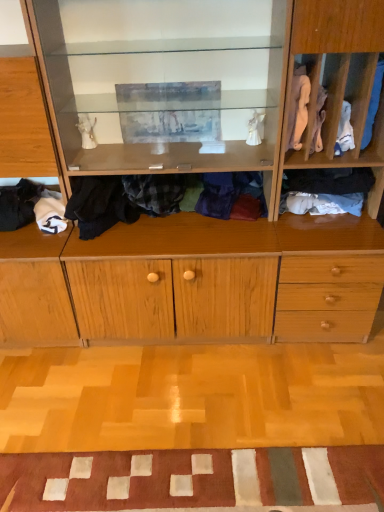
Image resolution: width=384 pixels, height=512 pixels. Describe the element at coordinates (35, 290) in the screenshot. I see `light wood cabinet at left, the second cabinetry in the right-to-left sequence` at that location.

In the scene shown: Measure the distance between point (131, 67) and camera.

Point (131, 67) and camera are 1.87 meters apart.

Measure the distance between wooden cabinet at center, which is the 1th cabinetry in right-to-left order, and camera.

wooden cabinet at center, which is the 1th cabinetry in right-to-left order, and camera are 4.68 feet apart from each other.

The image size is (384, 512). In order to click on soft white fabric at lower left, the sixth clothing positioned from the right in this screenshot , I will do `click(18, 204)`.

What do you see at coordinates (18, 204) in the screenshot? The height and width of the screenshot is (512, 384). I see `soft white fabric at lower left, which appears as the 1th clothing when viewed from the left` at bounding box center [18, 204].

The height and width of the screenshot is (512, 384). Identify the location of white fabric at right, the fourth clothing when ordered from right to left. (298, 106).

Identify the location of the 1st clothing behind the dark blue fabric at right, which appears as the third clothing when viewed from the right, counting from the anchor's position. click(x=18, y=204).

Considering the relative sizes of dark blue fabric at right, the fourth clothing in the left-to-right sequence, and soft white fabric at lower left, the sixth clothing positioned from the right, in the image provided, is dark blue fabric at right, the fourth clothing in the left-to-right sequence, smaller than soft white fabric at lower left, the sixth clothing positioned from the right,?

Correct, dark blue fabric at right, the fourth clothing in the left-to-right sequence, occupies less space than soft white fabric at lower left, the sixth clothing positioned from the right.

Is dark blue fabric at right, the fourth clothing in the left-to-right sequence, with soft white fabric at lower left, the sixth clothing positioned from the right?

Answer: No, dark blue fabric at right, the fourth clothing in the left-to-right sequence, is not beside soft white fabric at lower left, the sixth clothing positioned from the right.

From the image's perspective, is light wood cabinet at left, the second cabinetry in the right-to-left sequence, located above blue cotton socks at right, arranged as the 1th clothing when viewed from the right?

No, from the image's perspective, light wood cabinet at left, the second cabinetry in the right-to-left sequence, is not on top of blue cotton socks at right, arranged as the 1th clothing when viewed from the right.

Is light wood cabinet at left, marked as the first cabinetry in a left-to-right arrangement, far away from blue cotton socks at right, arranged as the 1th clothing when viewed from the right?

Yes.

Considering the sizes of objects light wood cabinet at left, marked as the first cabinetry in a left-to-right arrangement, and blue cotton socks at right, arranged as the 1th clothing when viewed from the right, in the image provided, who is bigger, light wood cabinet at left, marked as the first cabinetry in a left-to-right arrangement, or blue cotton socks at right, arranged as the 1th clothing when viewed from the right,?

light wood cabinet at left, marked as the first cabinetry in a left-to-right arrangement.

Which point is more forward, (56, 244) or (383, 59)?

The point (383, 59) is more forward.

From a real-world perspective, is wooden cabinet at center, which is the second cabinetry in left-to-right order, positioned over soft white fabric at lower left, which appears as the 1th clothing when viewed from the left, based on gravity?

Yes, from a real-world perspective, wooden cabinet at center, which is the second cabinetry in left-to-right order, is above soft white fabric at lower left, which appears as the 1th clothing when viewed from the left.

In terms of height, does wooden cabinet at center, which is the second cabinetry in left-to-right order, look taller or shorter compared to soft white fabric at lower left, the sixth clothing positioned from the right?

Considering their sizes, wooden cabinet at center, which is the second cabinetry in left-to-right order, has more height than soft white fabric at lower left, the sixth clothing positioned from the right.

Which object is further away from the camera, wooden cabinet at center, which is the second cabinetry in left-to-right order, or soft white fabric at lower left, the sixth clothing positioned from the right?

Positioned behind is soft white fabric at lower left, the sixth clothing positioned from the right.

From the image's perspective, which one is positioned higher, flannel shirt at center, which appears as the 5th clothing when viewed from the right, or white cotton socks at right, which appears as the 2th clothing when viewed from the right?

flannel shirt at center, which appears as the 5th clothing when viewed from the right, is shown above in the image.

Considering the relative sizes of flannel shirt at center, which appears as the 5th clothing when viewed from the right, and white cotton socks at right, which is the fifth clothing in left-to-right order, in the image provided, is flannel shirt at center, which appears as the 5th clothing when viewed from the right, taller than white cotton socks at right, which is the fifth clothing in left-to-right order,?

Yes, flannel shirt at center, which appears as the 5th clothing when viewed from the right, is taller than white cotton socks at right, which is the fifth clothing in left-to-right order.

Is flannel shirt at center, which appears as the 5th clothing when viewed from the right, looking in the opposite direction of white cotton socks at right, which appears as the 2th clothing when viewed from the right?

No, flannel shirt at center, which appears as the 5th clothing when viewed from the right,'s orientation is not away from white cotton socks at right, which appears as the 2th clothing when viewed from the right.

The image size is (384, 512). There is a white cotton socks at right, which is the fifth clothing in left-to-right order. In order to click on the 2nd clothing above it (from a real-world perspective) in this screenshot , I will do `click(122, 200)`.

Is soft white fabric at lower left, which appears as the 1th clothing when viewed from the left, at the right side of white cotton socks at right, which appears as the 2th clothing when viewed from the right?

Incorrect, soft white fabric at lower left, which appears as the 1th clothing when viewed from the left, is not on the right side of white cotton socks at right, which appears as the 2th clothing when viewed from the right.

Based on the photo, is soft white fabric at lower left, the sixth clothing positioned from the right, smaller than white cotton socks at right, which is the fifth clothing in left-to-right order?

No.

Find the location of a particular element. The image size is (384, 512). clothing behind the soft white fabric at lower left, which appears as the 1th clothing when viewed from the left is located at coordinates (321, 203).

Considering the positions of points (11, 188) and (349, 212), is point (11, 188) farther from camera compared to point (349, 212)?

Yes, it is behind point (349, 212).

From the image's perspective, who appears lower, blue cotton socks at right, the 6th clothing viewed from the left, or wooden cabinet at center, which is the second cabinetry in left-to-right order?

wooden cabinet at center, which is the second cabinetry in left-to-right order, from the image's perspective.

Is point (376, 101) farther from camera compared to point (227, 240)?

No, (376, 101) is closer to viewer.

Considering the relative positions of blue cotton socks at right, arranged as the 1th clothing when viewed from the right, and wooden cabinet at center, which is the second cabinetry in left-to-right order, in the image provided, is blue cotton socks at right, arranged as the 1th clothing when viewed from the right, to the left or to the right of wooden cabinet at center, which is the second cabinetry in left-to-right order,?

blue cotton socks at right, arranged as the 1th clothing when viewed from the right, is to the right of wooden cabinet at center, which is the second cabinetry in left-to-right order.

Between blue cotton socks at right, the 6th clothing viewed from the left, and wooden cabinet at center, which is the second cabinetry in left-to-right order, which one is positioned behind?

blue cotton socks at right, the 6th clothing viewed from the left, is further away from the camera.

Who is shorter, blue cotton socks at right, arranged as the 1th clothing when viewed from the right, or white cotton socks at right, which appears as the 2th clothing when viewed from the right?

Standing shorter between the two is white cotton socks at right, which appears as the 2th clothing when viewed from the right.

Between blue cotton socks at right, arranged as the 1th clothing when viewed from the right, and white cotton socks at right, which is the fifth clothing in left-to-right order, which one has larger size?

With larger size is white cotton socks at right, which is the fifth clothing in left-to-right order.

Could white cotton socks at right, which is the fifth clothing in left-to-right order, be considered to be inside blue cotton socks at right, the 6th clothing viewed from the left?

Definitely not — white cotton socks at right, which is the fifth clothing in left-to-right order, is not inside blue cotton socks at right, the 6th clothing viewed from the left.

Considering the points (362, 145) and (360, 203), which point is in front, point (362, 145) or point (360, 203)?

The point (362, 145) is in front.

From the soft white fabric at lower left, which appears as the 1th clothing when viewed from the left, count 3rd clothing to the right and point to it. Please provide its 2D coordinates.

[(327, 187)]

This screenshot has height=512, width=384. I want to click on the 1st cabinetry in front of the blue cotton socks at right, the 6th clothing viewed from the left, counting from the anchor's position, so click(35, 290).

Considering their positions, is white fabric at right, the third clothing in the left-to-right sequence, positioned further to flannel shirt at center, the second clothing when ordered from left to right, than patchwork fabric doormat at lower center?

patchwork fabric doormat at lower center is further to flannel shirt at center, the second clothing when ordered from left to right.

In the scene shown: Which object lies nearer to the anchor point flannel shirt at center, which appears as the 5th clothing when viewed from the right, soft white fabric at lower left, which appears as the 1th clothing when viewed from the left, or white cotton socks at right, which appears as the 2th clothing when viewed from the right?

soft white fabric at lower left, which appears as the 1th clothing when viewed from the left, is positioned closer to the anchor flannel shirt at center, which appears as the 5th clothing when viewed from the right.

Considering their positions, is white cotton socks at right, which is the fifth clothing in left-to-right order, positioned further to blue cotton socks at right, arranged as the 1th clothing when viewed from the right, than wooden cabinet at center, which is the 1th cabinetry in right-to-left order?

Based on the image, wooden cabinet at center, which is the 1th cabinetry in right-to-left order, appears to be further to blue cotton socks at right, arranged as the 1th clothing when viewed from the right.

Estimate the real-world distances between objects in this image. Which object is closer to wooden cabinet at center, which is the 1th cabinetry in right-to-left order, white cotton socks at right, which appears as the 2th clothing when viewed from the right, or flannel shirt at center, the second clothing when ordered from left to right?

Based on the image, flannel shirt at center, the second clothing when ordered from left to right, appears to be nearer to wooden cabinet at center, which is the 1th cabinetry in right-to-left order.

Estimate the real-world distances between objects in this image. Which object is closer to white fabric at right, the third clothing in the left-to-right sequence, wooden cabinet at center, which is the 1th cabinetry in right-to-left order, or dark blue fabric at right, which appears as the third clothing when viewed from the right?

dark blue fabric at right, which appears as the third clothing when viewed from the right.

From the picture: When comparing their distances from blue cotton socks at right, arranged as the 1th clothing when viewed from the right, does dark blue fabric at right, which appears as the third clothing when viewed from the right, or light wood cabinet at left, the second cabinetry in the right-to-left sequence, seem further?

light wood cabinet at left, the second cabinetry in the right-to-left sequence.

Considering their positions, is wooden cabinet at center, which is the second cabinetry in left-to-right order, positioned further to flannel shirt at center, which appears as the 5th clothing when viewed from the right, than light wood cabinet at left, marked as the first cabinetry in a left-to-right arrangement?

The object further to flannel shirt at center, which appears as the 5th clothing when viewed from the right, is light wood cabinet at left, marked as the first cabinetry in a left-to-right arrangement.

Estimate the real-world distances between objects in this image. Which object is further from wooden cabinet at center, which is the second cabinetry in left-to-right order, white fabric at right, the third clothing in the left-to-right sequence, or light wood cabinet at left, the second cabinetry in the right-to-left sequence?

The object further to wooden cabinet at center, which is the second cabinetry in left-to-right order, is white fabric at right, the third clothing in the left-to-right sequence.

I want to click on doormat between soft white fabric at lower left, which appears as the 1th clothing when viewed from the left, and blue cotton socks at right, arranged as the 1th clothing when viewed from the right, so click(x=195, y=479).

This screenshot has height=512, width=384. I want to click on cabinetry between flannel shirt at center, the second clothing when ordered from left to right, and dark blue fabric at right, which appears as the third clothing when viewed from the right, so pyautogui.click(x=202, y=172).

Where is `cabinetry situated between soft white fabric at lower left, the sixth clothing positioned from the right, and blue cotton socks at right, arranged as the 1th clothing when viewed from the right, from left to right`? Image resolution: width=384 pixels, height=512 pixels. cabinetry situated between soft white fabric at lower left, the sixth clothing positioned from the right, and blue cotton socks at right, arranged as the 1th clothing when viewed from the right, from left to right is located at coordinates (202, 172).

You are a GUI agent. You are given a task and a screenshot of the screen. Output one action in this format:
    pyautogui.click(x=<x>, y=<y>)
    Task: Click on the cabinetry between soft white fabric at lower left, which appears as the 1th clothing when viewed from the left, and white fabric at right, the third clothing in the left-to-right sequence
    Image resolution: width=384 pixels, height=512 pixels.
    Given the screenshot: What is the action you would take?
    pyautogui.click(x=202, y=172)